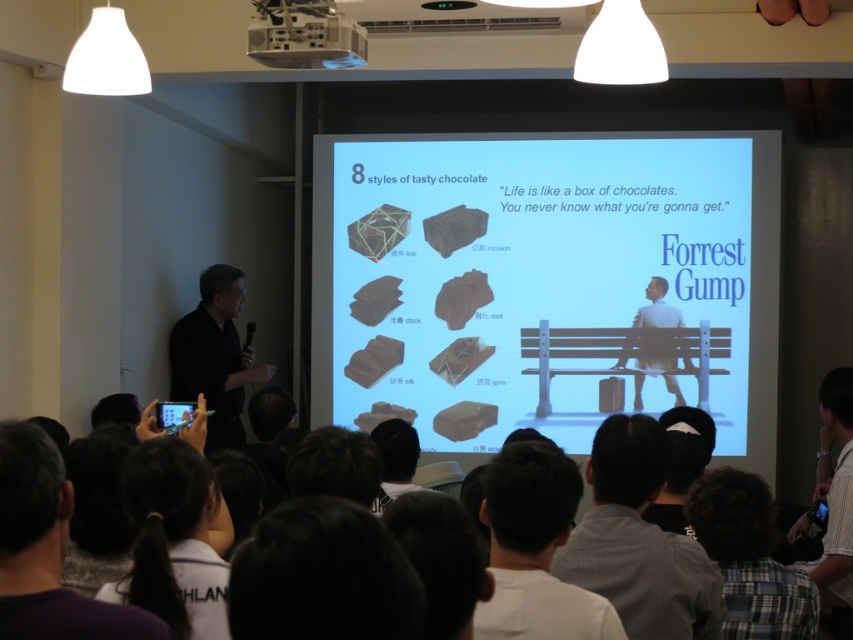
Question: Is purple fabric ponytail at lower left above light blue fabric man at center?

Choices:
 (A) yes
 (B) no

Answer: (B)

Question: Is matte plastic projection screen at center closer to the viewer compared to dark brown hair at center?

Choices:
 (A) no
 (B) yes

Answer: (A)

Question: Which point appears closest to the camera in this image?

Choices:
 (A) (619, 380)
 (B) (212, 321)
 (C) (22, 540)
 (D) (286, 56)

Answer: (C)

Question: Based on their relative distances, which object is farther from the gray shirt at lower right?

Choices:
 (A) dark brown hair at center
 (B) black matte suit at left

Answer: (B)

Question: Which object is the closest to the white plastic projector at upper center?

Choices:
 (A) dark gray shirt at center
 (B) striped cotton shirt at lower right
 (C) matte plastic projection screen at center

Answer: (C)

Question: Is matte plastic projection screen at center bigger than dark purple shirt at lower left?

Choices:
 (A) yes
 (B) no

Answer: (A)